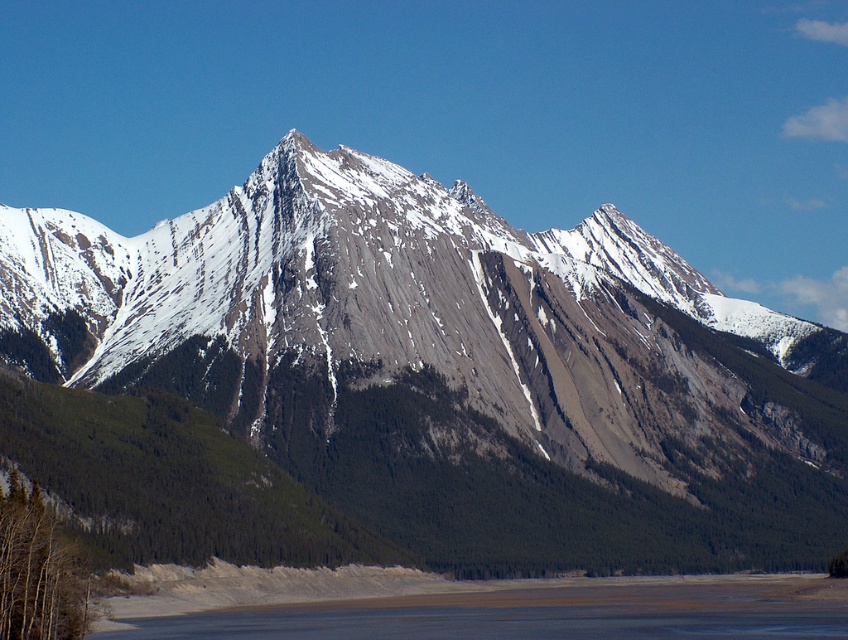
Describe the element at coordinates (416, 385) in the screenshot. I see `gray rocky mountain at center` at that location.

Between point (210, 243) and point (717, 580), which one is positioned behind?

Positioned behind is point (717, 580).

Locate an element on the screen. gray rocky mountain at center is located at coordinates (416, 385).

What are the coordinates of `gray rocky mountain at center` in the screenshot? It's located at (416, 385).